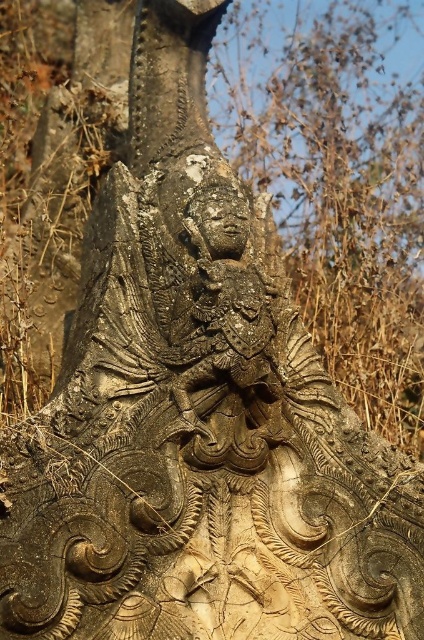
Image resolution: width=424 pixels, height=640 pixels. Describe the element at coordinates (225, 301) in the screenshot. I see `carved stone deity at center` at that location.

Is carved stone deity at center further to camera compared to carved stone face at center?

No, carved stone deity at center is closer to the viewer.

Who is more forward, (220, 268) or (228, 244)?

Point (220, 268) is in front.

You are a GUI agent. You are given a task and a screenshot of the screen. Output one action in this format:
    pyautogui.click(x=<x>, y=<y>)
    Task: Click on the carved stone deity at center
    The width and height of the screenshot is (424, 640).
    Given the screenshot: What is the action you would take?
    pyautogui.click(x=225, y=301)